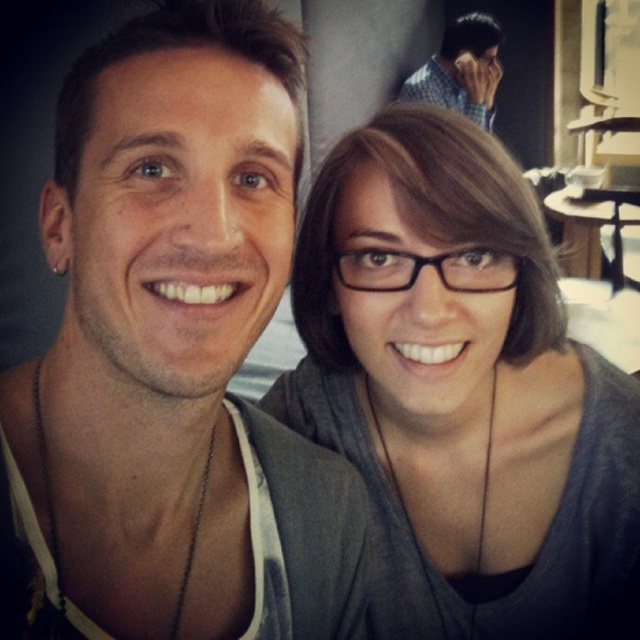
Question: Which of these objects is positioned farthest from the checkered shirt at upper right?

Choices:
 (A) matte black shirt at center
 (B) gray matte shirt at center

Answer: (A)

Question: Observing the image, what is the correct spatial positioning of gray matte shirt at center in reference to checkered shirt at upper right?

Choices:
 (A) below
 (B) above

Answer: (A)

Question: Does gray matte shirt at center appear on the right side of checkered shirt at upper right?

Choices:
 (A) no
 (B) yes

Answer: (A)

Question: Which object is closer to the camera taking this photo?

Choices:
 (A) matte black shirt at center
 (B) checkered shirt at upper right
 (C) gray matte shirt at center

Answer: (A)

Question: Which point is closer to the camera?

Choices:
 (A) matte black shirt at center
 (B) checkered shirt at upper right

Answer: (A)

Question: From the image, what is the correct spatial relationship of matte black shirt at center in relation to checkered shirt at upper right?

Choices:
 (A) below
 (B) above

Answer: (A)